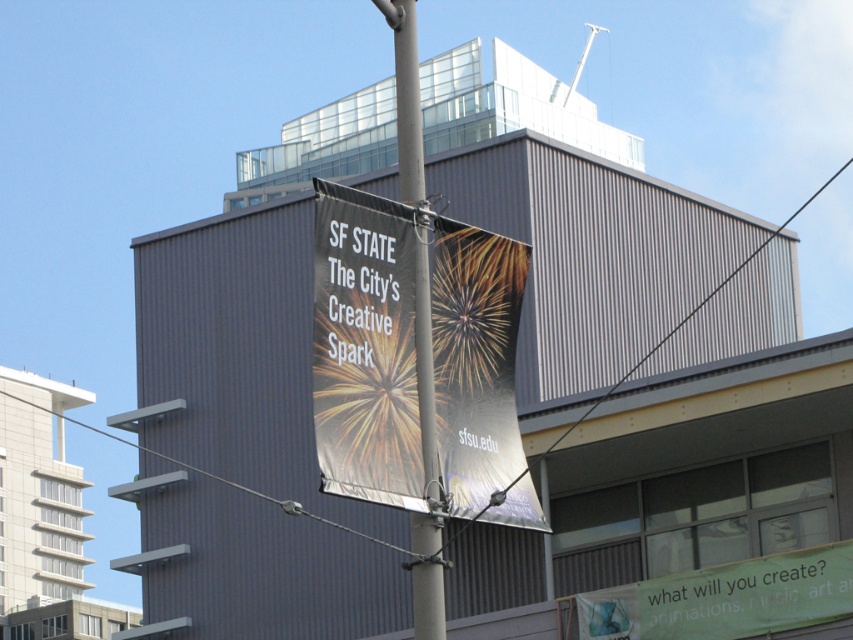
You are a photographer standing in front of the building. You want to capture both the metallic banner at center and the green fabric banner at lower right in your photo. Which banner will appear closer to the camera in the final image?

The metallic banner at center will appear closer to the camera in the final image because it is positioned in front of the green fabric banner at lower right.

You are a city planner assessing the space in front of the building. You need to determine if the green fabric banner at lower right can be replaced with a new banner that is twice as wide as the metallic pole at center. Based on the current dimensions, is this feasible?

The green fabric banner at lower right might be wider than metallic pole at center. If the banner is already wider than the pole, then doubling its width would make it even wider, so it might not be feasible. However, if the banner is narrower, then it could be possible. The exact dimensions are not provided, so a definitive answer requires more information.

You are a photographer standing in front of the modern building. You want to capture a photo that includes both the metallic banner at center and the metallic pole at center. Based on their positions, which object should appear higher in the photo?

The metallic pole at center should appear higher in the photo because the metallic banner at center is located below it.